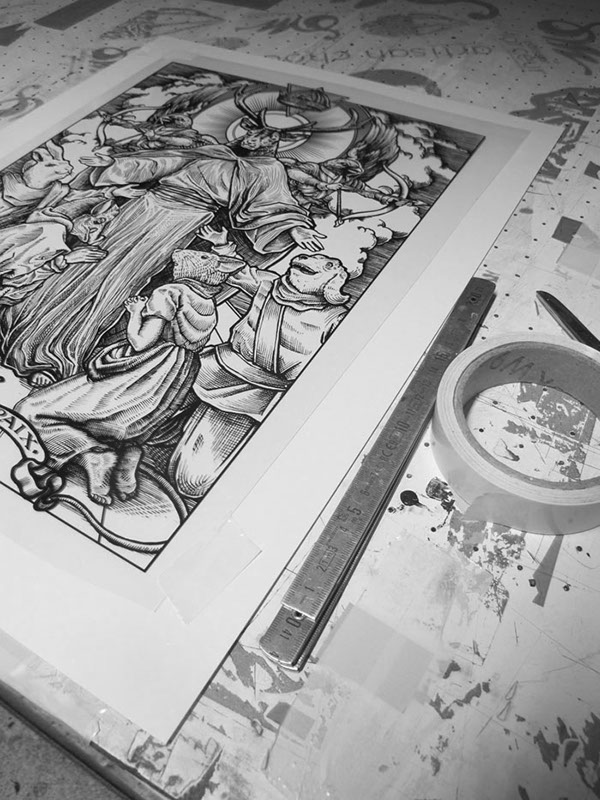
Where is `work surface`? The width and height of the screenshot is (600, 800). work surface is located at coordinates (412, 694), (568, 226), (48, 45), (413, 64).